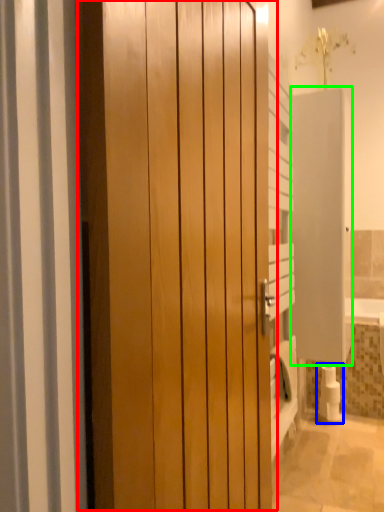
Question: Which is farther away from door (highlighted by a red box)? toilet paper (highlighted by a blue box) or screen door (highlighted by a green box)?

Choices:
 (A) toilet paper
 (B) screen door

Answer: (A)